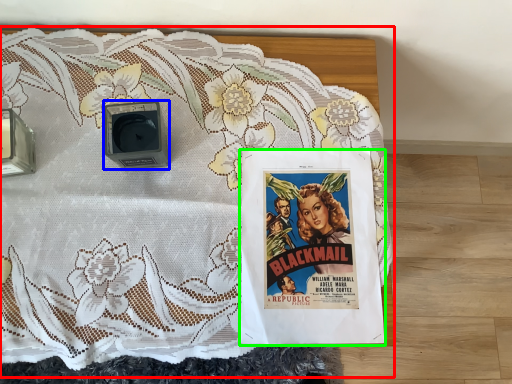
Question: Estimate the real-world distances between objects in this image. Which object is farther from bed (highlighted by a red box), alarm (highlighted by a blue box) or poster (highlighted by a green box)?

Choices:
 (A) alarm
 (B) poster

Answer: (A)